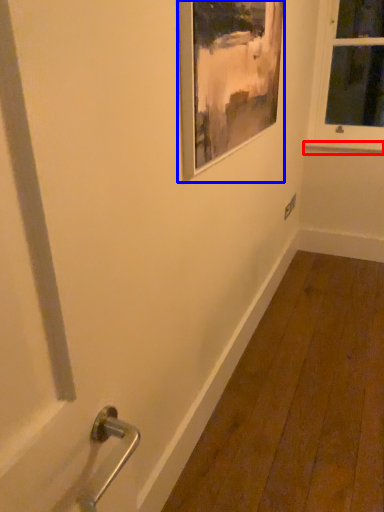
Question: Among these objects, which one is farthest to the camera, window sill (highlighted by a red box) or picture frame (highlighted by a blue box)?

Choices:
 (A) window sill
 (B) picture frame

Answer: (A)